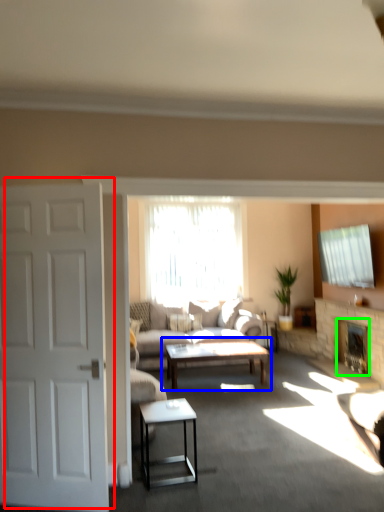
Question: Which object is the farthest from door (highlighted by a red box)? Choose among these: coffee table (highlighted by a blue box) or fireplace (highlighted by a green box).

Choices:
 (A) coffee table
 (B) fireplace

Answer: (B)